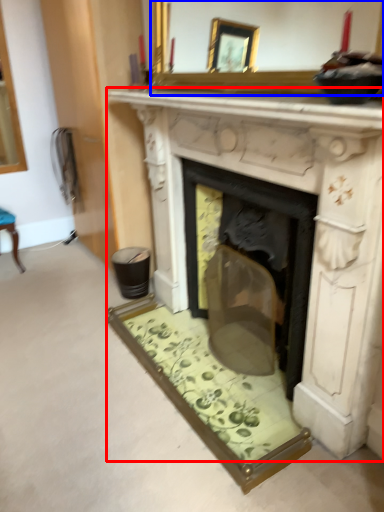
Question: Among these objects, which one is farthest to the camera, fireplace (highlighted by a red box) or mirror (highlighted by a blue box)?

Choices:
 (A) fireplace
 (B) mirror

Answer: (A)